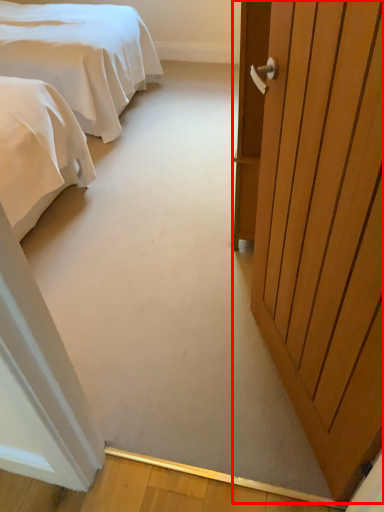
Question: Considering the relative positions of door (annotated by the red box) and bed in the image provided, where is door (annotated by the red box) located with respect to the staircase?

Choices:
 (A) left
 (B) right

Answer: (B)